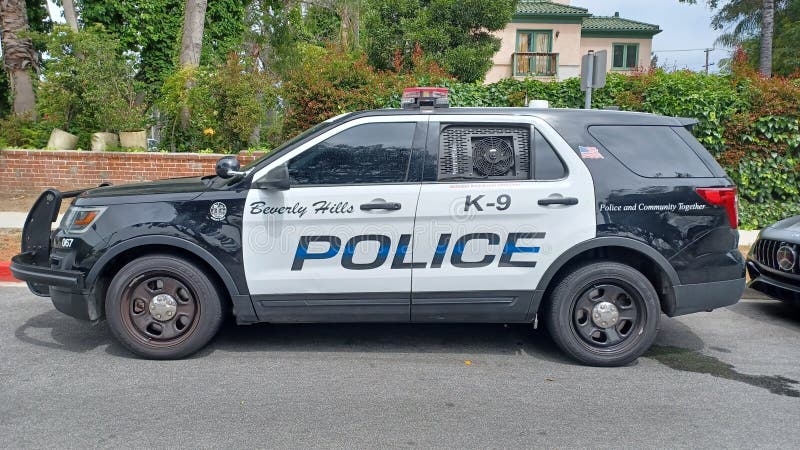
Where is `door handle`? The width and height of the screenshot is (800, 450). door handle is located at coordinates (378, 211), (549, 197).